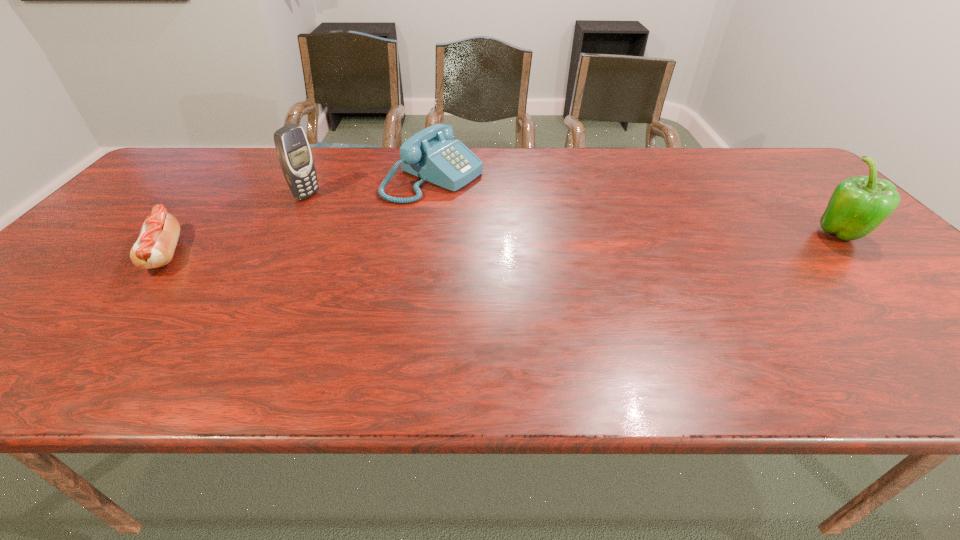
This screenshot has height=540, width=960. In order to click on vacant spot on the desktop that is between the leftmost object and the rightmost object and is positioned on the dial of the second object from right to left in this screenshot , I will do `click(601, 242)`.

The height and width of the screenshot is (540, 960). Find the location of `free spot on the desktop that is between the leftmost object and the rightmost object and is positioned on the front face of the cellular telephone`. free spot on the desktop that is between the leftmost object and the rightmost object and is positioned on the front face of the cellular telephone is located at coordinates (440, 246).